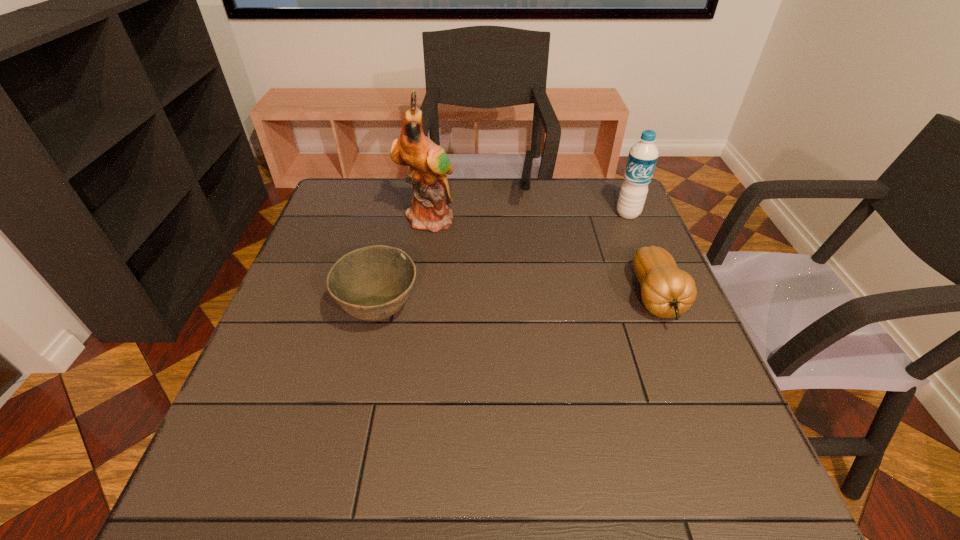
Locate an element on the screen. Image resolution: width=960 pixels, height=540 pixels. free space on the desktop that is between the bowl and the gourd and is positioned on the front-facing side of the third object from right to left is located at coordinates (507, 306).

This screenshot has width=960, height=540. In order to click on free space on the desktop that is between the bowl and the gourd and is positioned on the front-facing side of the parrot in this screenshot , I will do `click(505, 306)`.

I want to click on vacant space on the desktop that is between the bowl and the gourd and is positioned on the label of the water bottle, so tap(561, 303).